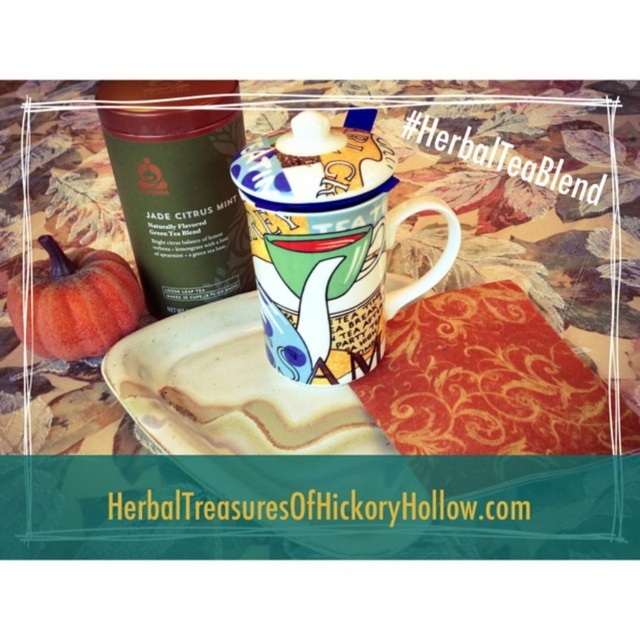
Is matte ceramic plate at center thinner than green matte tin at upper left?

Incorrect, matte ceramic plate at center's width is not less than green matte tin at upper left's.

Is matte ceramic plate at center further to the viewer compared to green matte tin at upper left?

No, it is not.

Is point (221, 340) positioned before point (205, 173)?

No, (221, 340) is behind (205, 173).

You are a GUI agent. You are given a task and a screenshot of the screen. Output one action in this format:
    pyautogui.click(x=<x>, y=<y>)
    Task: Click on the matte ceramic plate at center
    This screenshot has width=640, height=640.
    Given the screenshot: What is the action you would take?
    pyautogui.click(x=381, y=440)

Measure the distance from matte ceramic plate at center to orange matte pumpkin at lower left.

matte ceramic plate at center and orange matte pumpkin at lower left are 10.80 inches apart.

Consider the image. Is matte ceramic plate at center above orange matte pumpkin at lower left?

Actually, matte ceramic plate at center is below orange matte pumpkin at lower left.

You are a GUI agent. You are given a task and a screenshot of the screen. Output one action in this format:
    pyautogui.click(x=<x>, y=<y>)
    Task: Click on the matte ceramic plate at center
    This screenshot has width=640, height=640.
    Given the screenshot: What is the action you would take?
    pyautogui.click(x=381, y=440)

This screenshot has width=640, height=640. Find the location of `matte ceramic plate at center`. matte ceramic plate at center is located at coordinates (381, 440).

Is porcelain mug with colorful design at center wider than orange matte pumpkin at lower left?

Incorrect, porcelain mug with colorful design at center's width does not surpass orange matte pumpkin at lower left's.

Who is more distant from viewer, (289,324) or (99,321)?

Positioned behind is point (99,321).

Who is more forward, (436, 275) or (106, 337)?

Positioned in front is point (436, 275).

Identify the location of porcelain mug with colorful design at center. This screenshot has width=640, height=640. (326, 243).